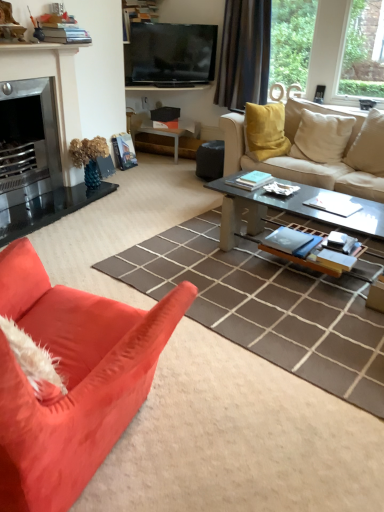
Question: Relative to beige fabric pillow at upper right, the 1th pillow viewed from the right, is black fabric curtain at upper center in front or behind?

Choices:
 (A) behind
 (B) front

Answer: (A)

Question: From the image's perspective, is black fabric curtain at upper center above or below beige fabric pillow at upper right, the 1th pillow viewed from the right?

Choices:
 (A) below
 (B) above

Answer: (B)

Question: Which is nearer to the black fabric curtain at upper center?

Choices:
 (A) suede-like orange couch at lower left, arranged as the 2th studio couch when viewed from the right
 (B) matte white side table at center
 (C) flat screen tv at upper center
 (D) beige fabric pillow at upper right, the 1th pillow viewed from the right
 (E) brushed metal fireplace at left

Answer: (C)

Question: Based on their relative distances, which object is nearer to the flat screen tv at upper center?

Choices:
 (A) suede-like orange couch at lower left, the 2th studio couch when ordered from top to bottom
 (B) clear glass coffee table at center
 (C) brushed metal fireplace at left
 (D) black fabric curtain at upper center
 (E) beige fabric pillow at upper right, the 1th pillow viewed from the right

Answer: (D)